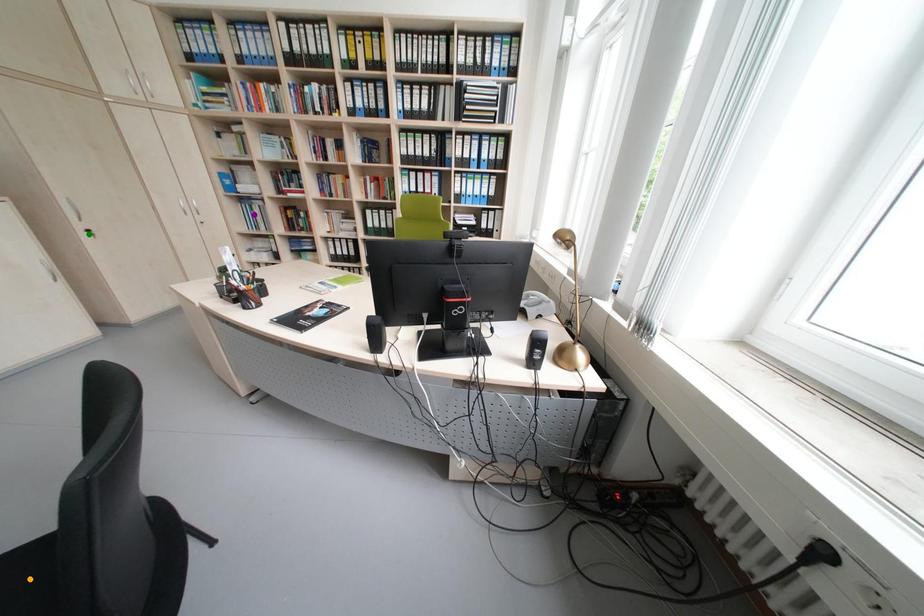
Order these from farthest to nearest:
purple point, green point, orange point

purple point, green point, orange point